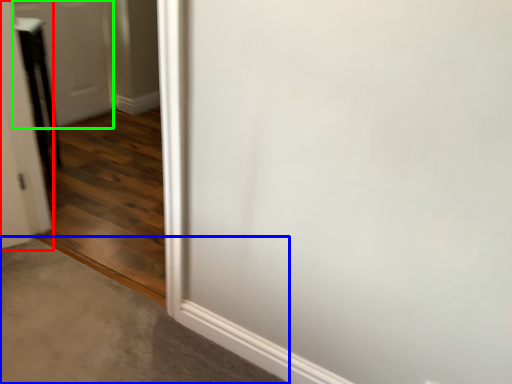
Question: Which is farther away from door (highlighted by a red box)? concrete (highlighted by a blue box) or door (highlighted by a green box)?

Choices:
 (A) concrete
 (B) door

Answer: (B)